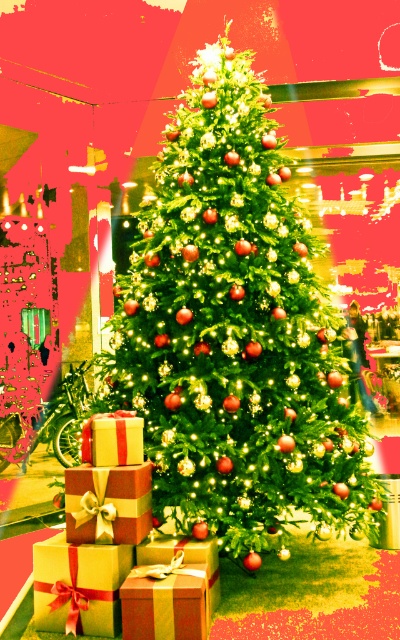
Which is more to the left, green matte christmas tree at center or gold shiny gift at center?

Positioned to the left is gold shiny gift at center.

Find the location of a particular element. Image resolution: width=400 pixels, height=640 pixels. green matte christmas tree at center is located at coordinates (235, 332).

Is gold striped gift at center in front of matte gold gift at center?

Yes, it is.

This screenshot has height=640, width=400. I want to click on gold striped gift at center, so click(166, 602).

Does point (148, 611) come closer to viewer compared to point (140, 429)?

That is True.

Is gold striped gift at center positioned at the back of gold shiny gift at center?

That is False.

The width and height of the screenshot is (400, 640). Find the location of `gold striped gift at center`. gold striped gift at center is located at coordinates (166, 602).